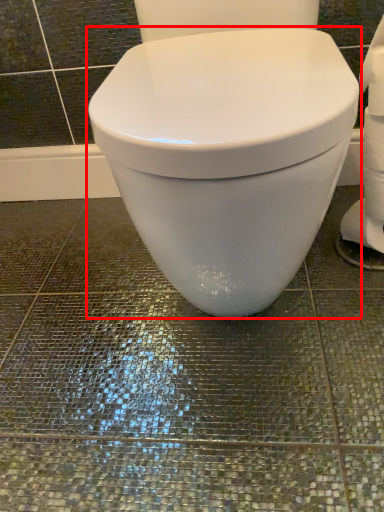
Question: From the image's perspective, where is toilet (annotated by the red box) located in relation to toilet paper in the image?

Choices:
 (A) below
 (B) above

Answer: (B)